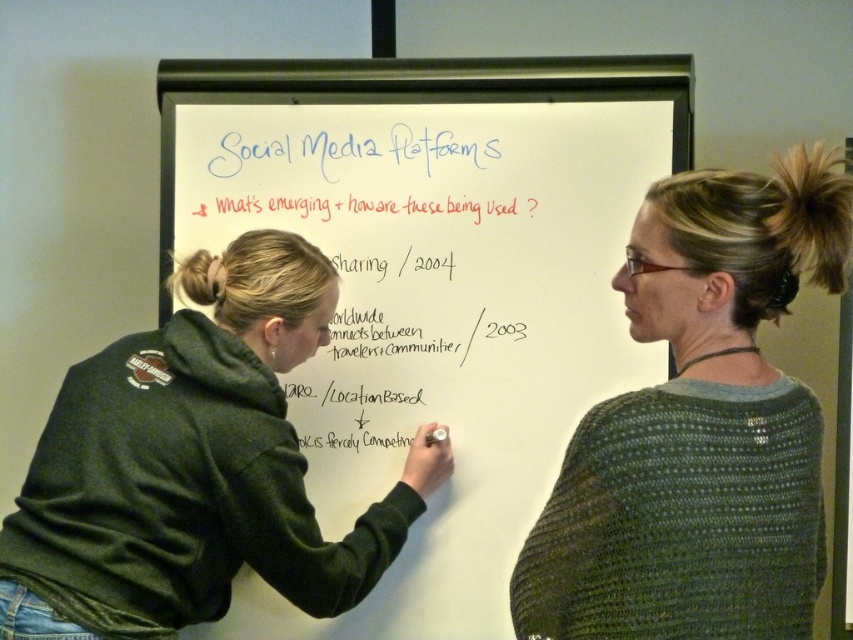
You are an attendee at the meeting. You notice two points on the whiteboard. The first point is labeled as point (547, 442) and the second is point (534, 632). From your perspective, which point is closer to the front of the whiteboard?

Point (534, 632) is closer to the front of the whiteboard because it is in front of point (547, 442).

You are an attendee at the meeting looking at the whiteboard at center and the green knitted sweater at upper right. Which object is positioned to the right side of the other?

The whiteboard at center is to the left of green knitted sweater at upper right, so the green knitted sweater at upper right is positioned to the right side of the whiteboard at center.

Looking at this image, you are a participant in the meeting and need to refer to the whiteboard at center and the green knitted sweater at upper right. Which object is positioned higher in the image?

The whiteboard at center is positioned higher than the green knitted sweater at upper right.